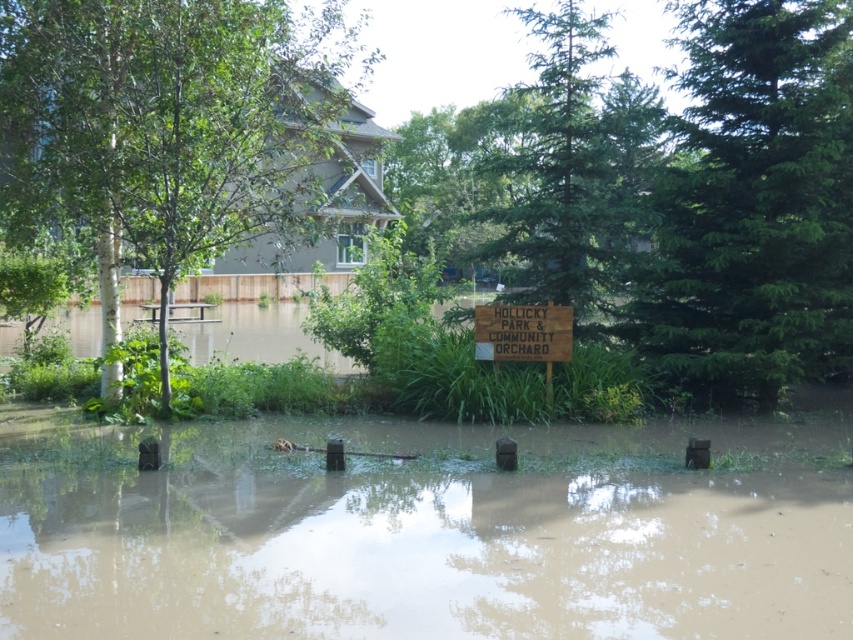
From the picture: Does green leafy tree at left appear over wooden sign at center?

Yes, green leafy tree at left is above wooden sign at center.

Does point (225, 166) come in front of point (534, 316)?

That is True.

The image size is (853, 640). Identify the location of green leafy tree at left. (x=167, y=122).

Can you confirm if brown muddy water at lower center is positioned to the right of green leafy tree at left?

Correct, you'll find brown muddy water at lower center to the right of green leafy tree at left.

Does brown muddy water at lower center come behind green leafy tree at left?

No, it is in front of green leafy tree at left.

Who is more forward, (425, 502) or (131, 60)?

Positioned in front is point (425, 502).

This screenshot has width=853, height=640. Identify the location of brown muddy water at lower center. pos(439,538).

Which is more to the right, green textured pine tree at center or wooden sign at center?

green textured pine tree at center is more to the right.

Does point (772, 74) lie behind point (572, 333)?

Yes.

This screenshot has height=640, width=853. Identify the location of green textured pine tree at center. (753, 200).

This screenshot has width=853, height=640. Identify the location of green textured pine tree at center. (753, 200).